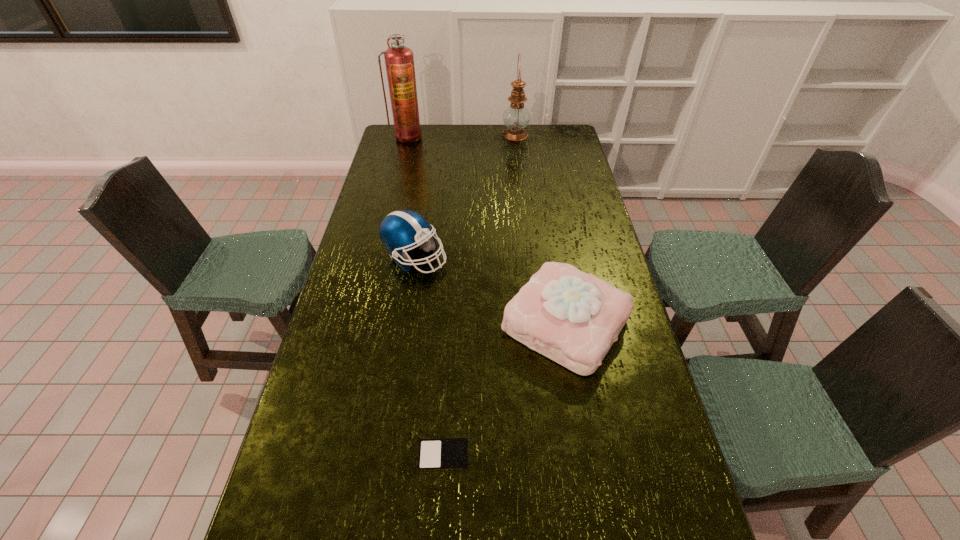
Find the location of `vacant space located 0.110m on the left of the shortest object`. vacant space located 0.110m on the left of the shortest object is located at coordinates (373, 456).

Locate an element on the screen. Image resolution: width=960 pixels, height=540 pixels. fire extinguisher that is at the far edge is located at coordinates (399, 61).

Locate an element on the screen. oil lamp present at the far edge is located at coordinates (516, 117).

Where is `fire extinguisher that is at the left edge`? This screenshot has height=540, width=960. fire extinguisher that is at the left edge is located at coordinates (399, 61).

Where is `football helmet that is at the left edge`? The image size is (960, 540). football helmet that is at the left edge is located at coordinates (400, 230).

The image size is (960, 540). In order to click on object located at the right edge in this screenshot , I will do `click(571, 317)`.

This screenshot has width=960, height=540. What are the coordinates of `object present at the far left corner` in the screenshot? It's located at (399, 61).

The height and width of the screenshot is (540, 960). Find the location of `vacant space at the far edge`. vacant space at the far edge is located at coordinates (457, 131).

The image size is (960, 540). Find the location of `vacant space at the left edge of the desktop`. vacant space at the left edge of the desktop is located at coordinates (284, 474).

Identify the location of vacant space at the right edge of the desktop. (591, 224).